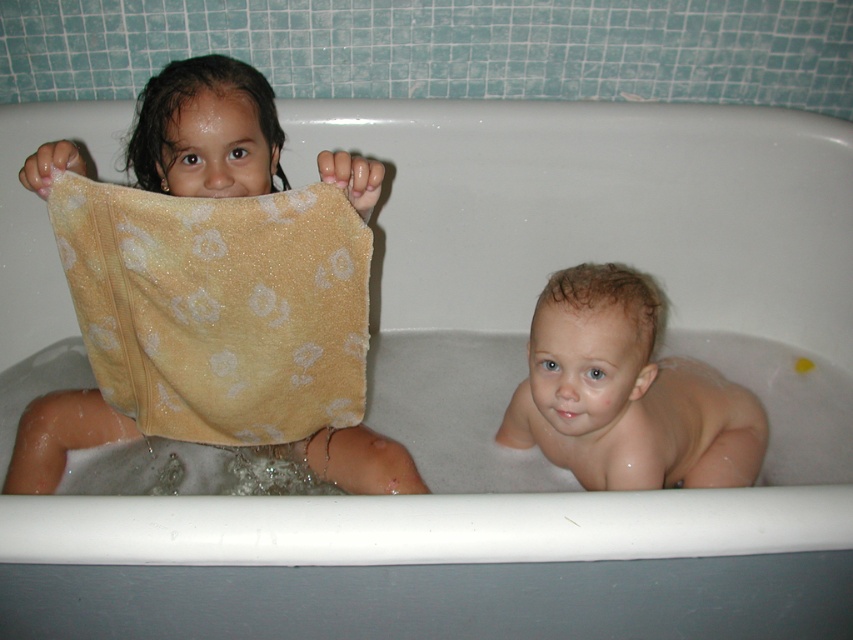
Question: Which object appears farthest from the camera in this image?

Choices:
 (A) light brown wet hair at lower right
 (B) yellow textured towel at left

Answer: (A)

Question: Can you confirm if light brown wet hair at lower right is thinner than yellow textured towel at left?

Choices:
 (A) no
 (B) yes

Answer: (A)

Question: Which of the following is the closest to the observer?

Choices:
 (A) (566, 340)
 (B) (39, 397)

Answer: (A)

Question: Which point is closer to the camera?

Choices:
 (A) yellow soft towel at upper left
 (B) yellow textured towel at left
 (C) light brown wet hair at lower right

Answer: (A)

Question: Is yellow soft towel at upper left thinner than yellow textured towel at left?

Choices:
 (A) yes
 (B) no

Answer: (A)

Question: Is yellow soft towel at upper left positioned before light brown wet hair at lower right?

Choices:
 (A) yes
 (B) no

Answer: (A)